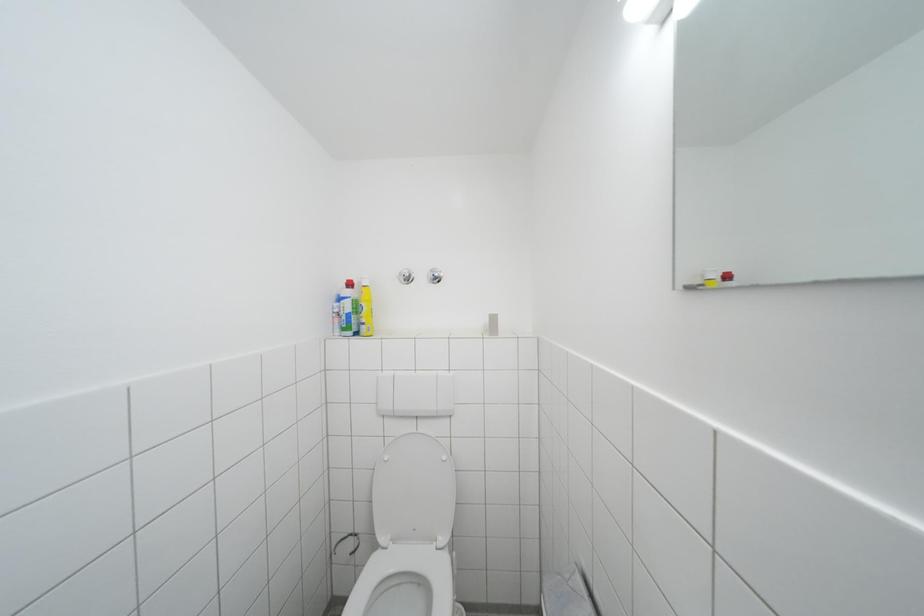
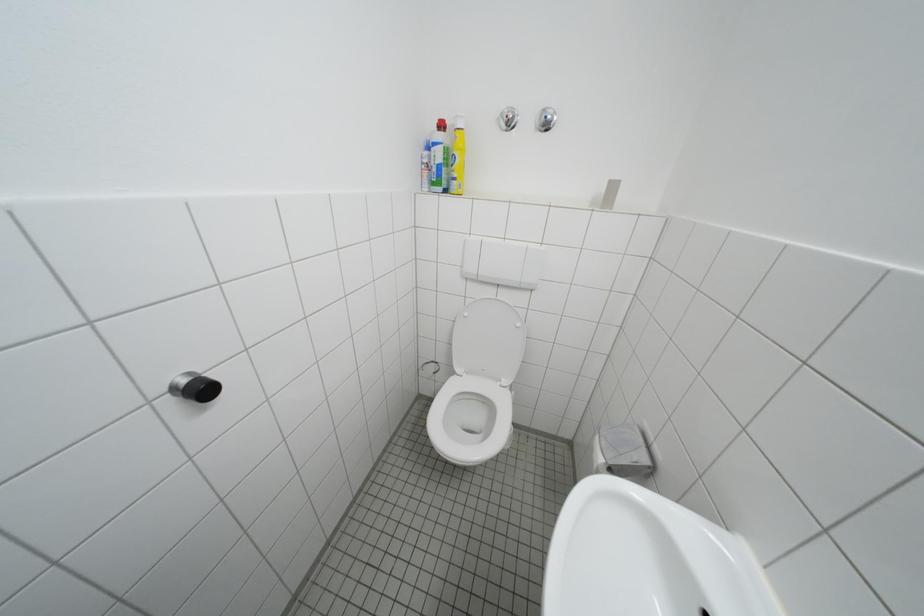
Question: Based on the continuous images, in which direction is the camera rotating? Reply with the corresponding letter.

Choices:
 (A) Left
 (B) Right
 (C) Up
 (D) Down

Answer: (D)